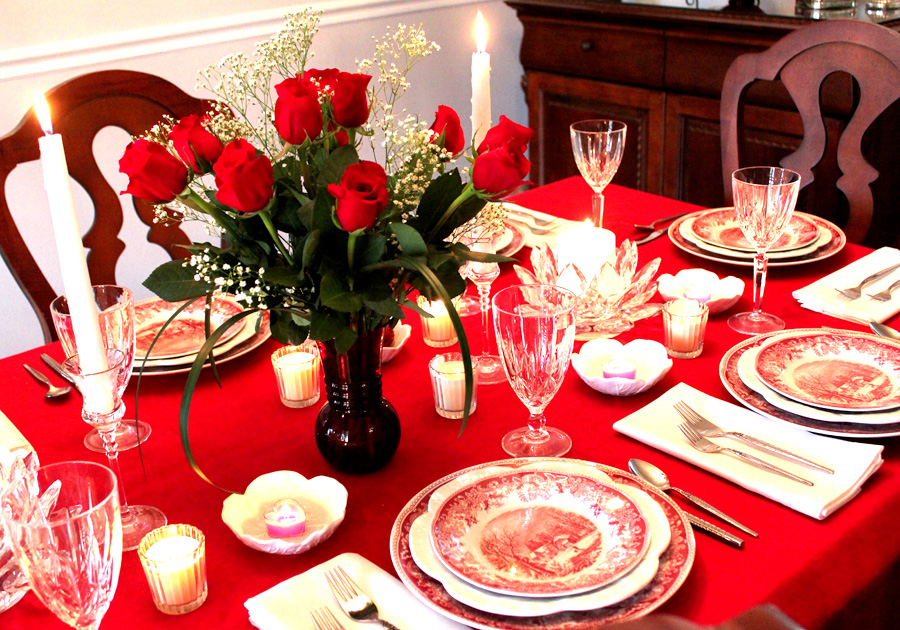
Where is `candles`? This screenshot has width=900, height=630. candles is located at coordinates coord(578,246), coord(682,318), coord(695,290), coord(482,268), coord(435,323), coord(450,380), coord(302,369), coord(292,515), coord(168,559), coord(94,369).